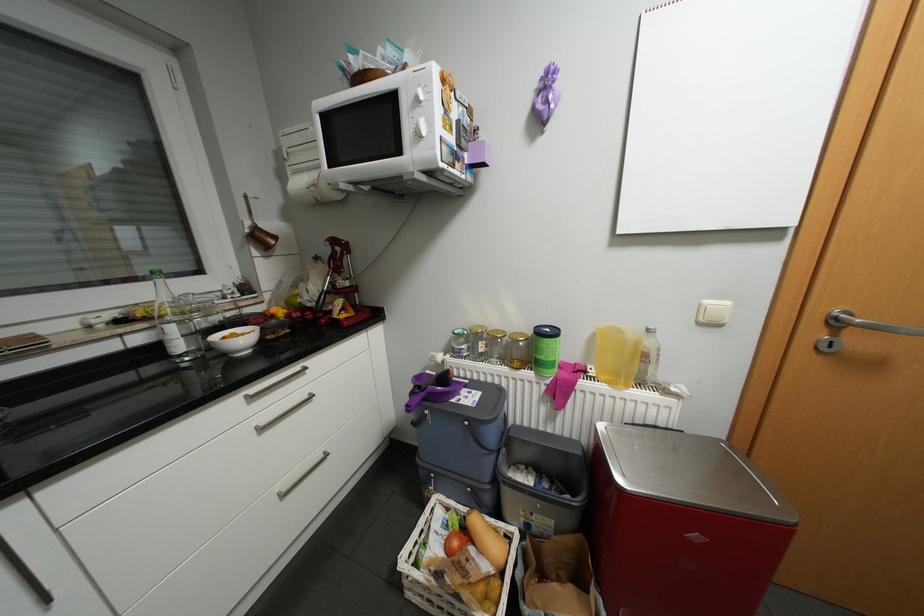
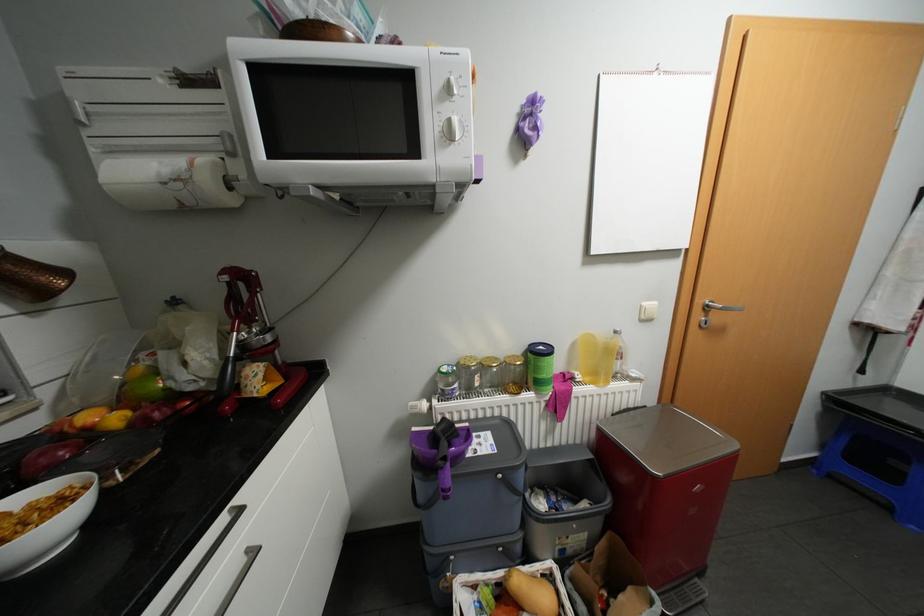
In the second image, find the point that corresponds to point 844,318 in the first image.

(715, 305)